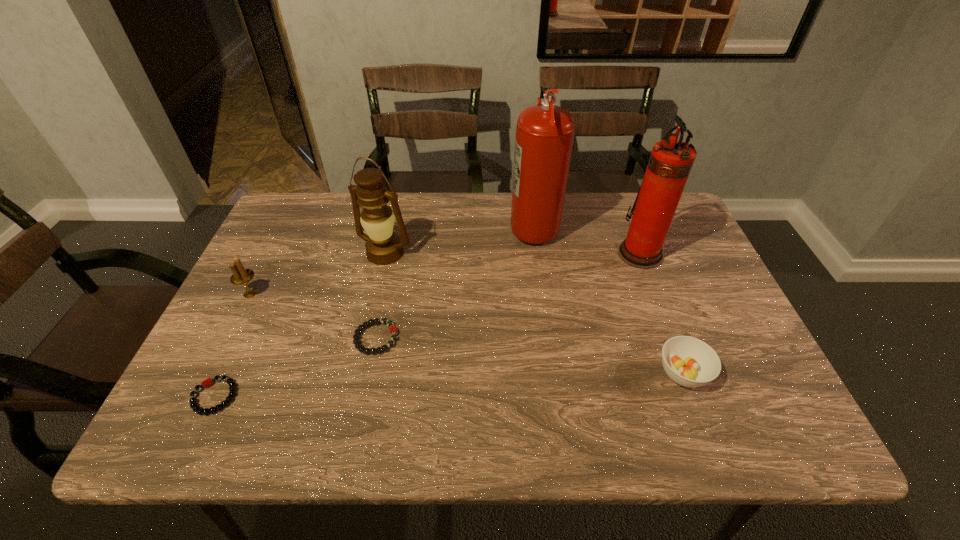
At what (x,y) coordinates should I click in order to perform the action: click on oil lamp present at the far edge. Please return your answer as a coordinate pair (x, y). The width and height of the screenshot is (960, 540). Looking at the image, I should click on (383, 247).

Locate an element on the screen. This screenshot has width=960, height=540. object that is positioned at the near edge is located at coordinates (194, 405).

At what (x,y) coordinates should I click in order to perform the action: click on candle holder that is positioned at the left edge. Please return your answer as a coordinate pair (x, y). Image resolution: width=960 pixels, height=540 pixels. Looking at the image, I should click on (241, 276).

You are a GUI agent. You are given a task and a screenshot of the screen. Output one action in this format:
    pyautogui.click(x=<x>, y=<y>)
    Task: Click on the bracelet present at the left edge
    Image resolution: width=960 pixels, height=540 pixels.
    Given the screenshot: What is the action you would take?
    pyautogui.click(x=194, y=405)

You are a GUI agent. You are given a task and a screenshot of the screen. Output one action in this format:
    pyautogui.click(x=<x>, y=<y>)
    Task: Click on the fire extinguisher positioned at the right edge
    The width and height of the screenshot is (960, 540).
    Given the screenshot: What is the action you would take?
    pyautogui.click(x=670, y=162)

Image resolution: width=960 pixels, height=540 pixels. In order to click on soup bowl present at the right edge in this screenshot , I will do `click(688, 361)`.

Locate an element on the screen. This screenshot has height=540, width=960. object positioned at the near left corner is located at coordinates (194, 405).

Find the location of a particular element. object that is at the far right corner is located at coordinates (670, 162).

Find the location of a particular element. This screenshot has width=960, height=540. vacant space at the far edge of the desktop is located at coordinates (468, 226).

Identify the location of vacant space at the near edge of the desktop. The width and height of the screenshot is (960, 540). (543, 407).